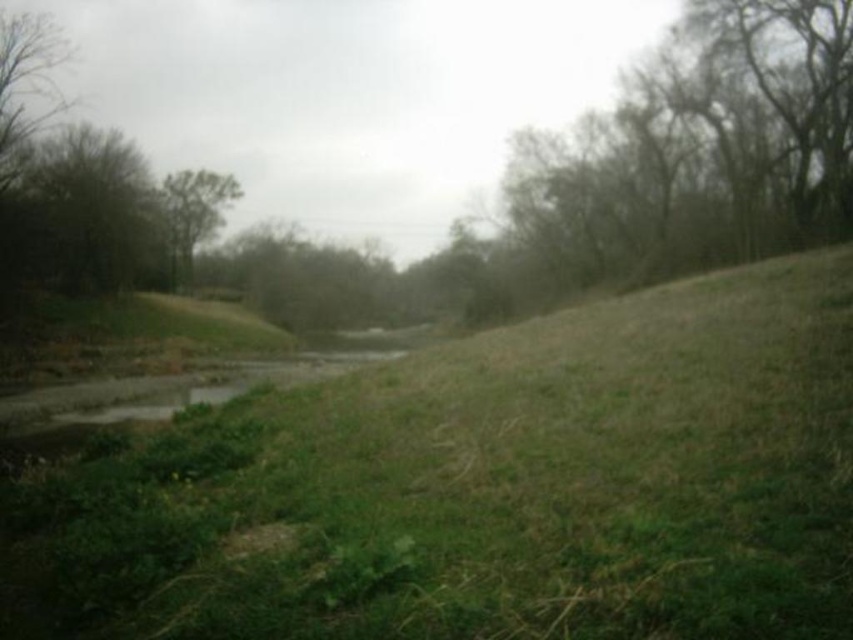
You are standing at the point marked as point (90,214) in the image. Looking around, you notice a green leafy tree at upper left. What is the direction of the green leafy tree at upper left relative to your current position?

The green leafy tree at upper left is located at point (90,214), which is your current position. Therefore, you are already at the location of the green leafy tree at upper left.

You are standing in the middle of the grassy area and want to take a photo of both the green leafy tree at upper left and the green leafy tree at center. Which tree should you position closer to the front of your photo to make them appear the same size?

Since the green leafy tree at upper left is smaller in size compared to the green leafy tree at center, you should position the green leafy tree at upper left closer to the front of your photo. This way, its closer proximity will compensate for its smaller size, making both trees appear roughly the same size in the photo.

You are a hiker trying to cross the stream in the middle ground. You notice the green grass at center and the green leafy tree at upper left. Which object would you use as a reference point to determine the direction of the stream flow?

The green leafy tree at upper left is larger than the green grass at center, so you can use its position to determine the stream flow direction by observing which way the tree leans due to water current.